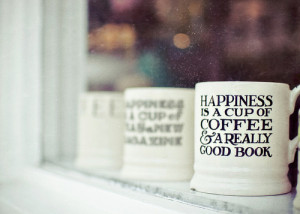
You are a GUI agent. You are given a task and a screenshot of the screen. Output one action in this format:
    pyautogui.click(x=<x>, y=<y>)
    Task: Click on the mug handle
    The height and width of the screenshot is (214, 300).
    Given the screenshot: What is the action you would take?
    pyautogui.click(x=296, y=92), pyautogui.click(x=294, y=146)